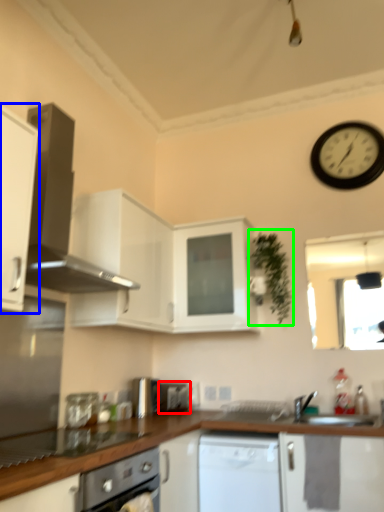
Question: Which object is positioned closest to appliance (highlighted by a red box)? Select from cabinetry (highlighted by a blue box) and plant (highlighted by a green box).

Choices:
 (A) cabinetry
 (B) plant

Answer: (B)